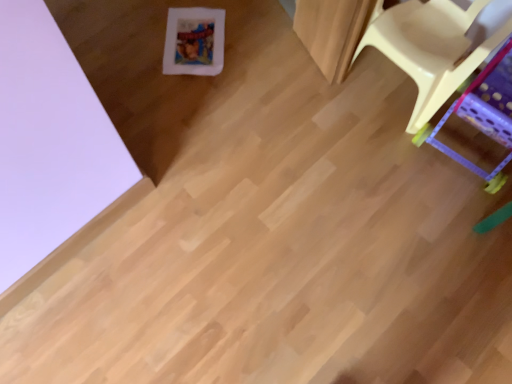
Identify the location of free space underneath yellow plastic chair at right, marked as the second furniture in a left-to-right arrangement (from a real-world perspective). (464, 150).